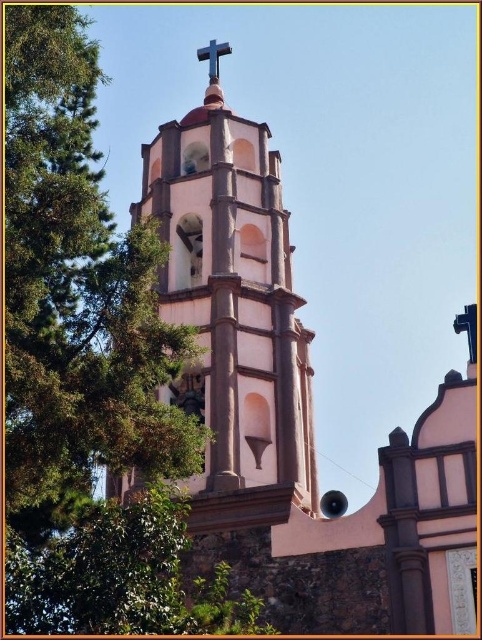
Which is in front, point (471, 464) or point (230, 138)?

Point (471, 464) is in front.

Which of these two, pink stucco church tower at center or pink stucco tower at center, stands taller?

pink stucco church tower at center

Find the location of a particular element. pink stucco church tower at center is located at coordinates (296, 410).

Between pink stucco church tower at center and metallic cross at upper center, which one appears on the right side from the viewer's perspective?

pink stucco church tower at center is more to the right.

Is pink stucco church tower at center to the left of metallic cross at upper center from the viewer's perspective?

Incorrect, pink stucco church tower at center is not on the left side of metallic cross at upper center.

This screenshot has height=640, width=482. What do you see at coordinates (296, 410) in the screenshot?
I see `pink stucco church tower at center` at bounding box center [296, 410].

Find the location of a particular element. This screenshot has height=640, width=482. pink stucco church tower at center is located at coordinates (296, 410).

Does pink stucco tower at center appear on the right side of metallic cross at upper center?

Correct, you'll find pink stucco tower at center to the right of metallic cross at upper center.

Locate an element on the screen. pink stucco tower at center is located at coordinates (233, 312).